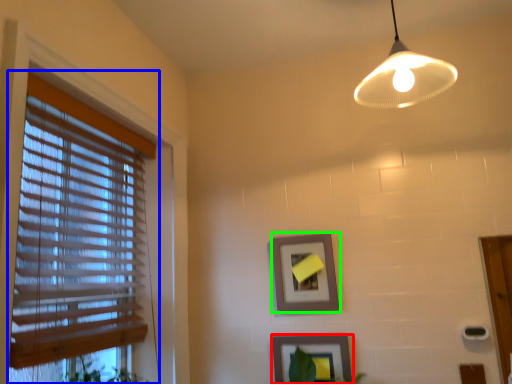
Question: Considering the real-world distances, which object is closest to picture frame (highlighted by a red box)? window blind (highlighted by a blue box) or picture frame (highlighted by a green box).

Choices:
 (A) window blind
 (B) picture frame

Answer: (B)